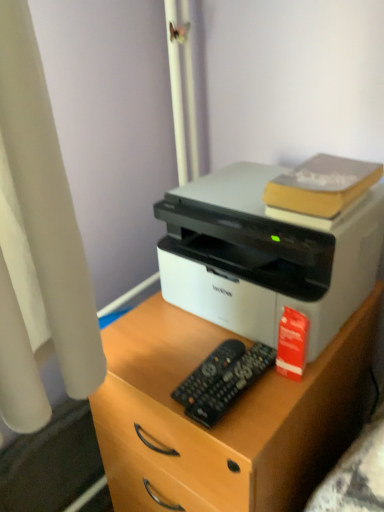
Question: Is red matte book at right, marked as the second book in a top-to-bottom arrangement, taller or shorter than white matte printer at center?

Choices:
 (A) short
 (B) tall

Answer: (A)

Question: In terms of size, does red matte book at right, marked as the second book in a top-to-bottom arrangement, appear bigger or smaller than white matte printer at center?

Choices:
 (A) big
 (B) small

Answer: (B)

Question: Which of these objects is positioned closest to the black plastic remote at center, the 1th control positioned from the front?

Choices:
 (A) white matte printer at center
 (B) white matte printer at center
 (C) black plastic remote at center, which is the second control from front to back
 (D) yellow matte book at upper right, the 2th book ordered from the bottom
 (E) red matte book at right, the 1th book ordered from the bottom

Answer: (C)

Question: Estimate the real-world distances between objects in this image. Which object is closer to the white matte printer at center?

Choices:
 (A) black plastic remote at center, which is the second control from front to back
 (B) red matte book at right, the 1th book ordered from the bottom
 (C) black plastic remote at center, marked as the second control in a back-to-front arrangement
 (D) yellow matte book at upper right, the 2th book ordered from the bottom
 (E) white matte printer at center

Answer: (D)